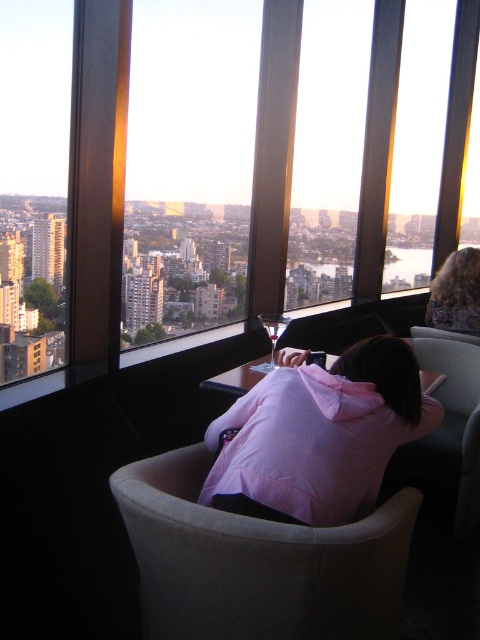
Question: Does light beige fabric chair at center appear over dark brown hair at upper right?

Choices:
 (A) no
 (B) yes

Answer: (A)

Question: Estimate the real-world distances between objects in this image. Which object is closer to the light beige fabric chair at center?

Choices:
 (A) transparent glass window at left
 (B) dark brown hair at upper right
 (C) transparent glass window at center

Answer: (B)

Question: Among these points, which one is nearest to the camera?

Choices:
 (A) (305, 604)
 (B) (475, 316)
 (C) (422, 120)
 (D) (352, 438)

Answer: (A)

Question: Which of the following is the closest to the observer?

Choices:
 (A) light beige fabric chair at center
 (B) dark brown hair at upper right
 (C) transparent glass window at center
 (D) pink fabric at center

Answer: (A)

Question: Does light beige fabric chair at center appear over dark brown hair at upper right?

Choices:
 (A) no
 (B) yes

Answer: (A)

Question: Is transparent glass window at center closer to camera compared to dark brown hair at upper right?

Choices:
 (A) no
 (B) yes

Answer: (B)